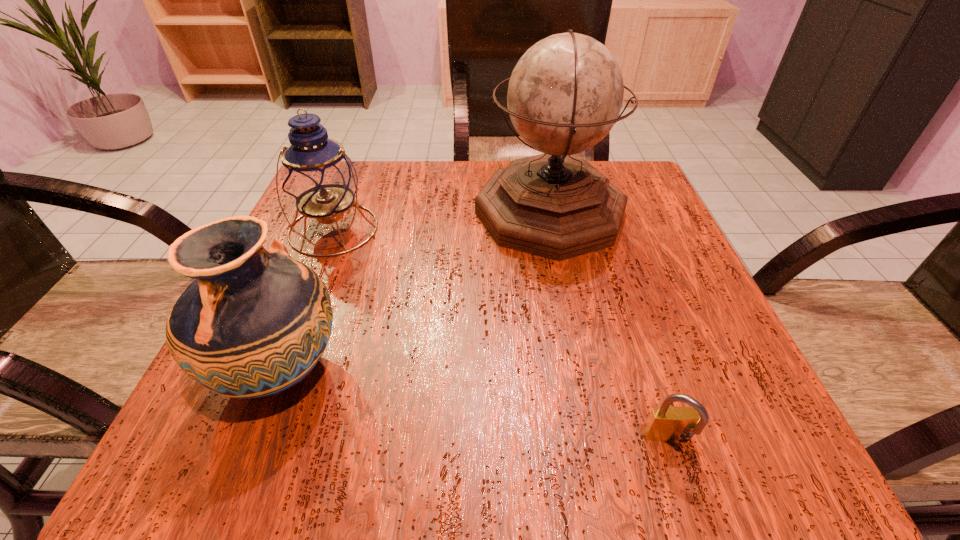
Identify the location of object situated at the near right corner. This screenshot has height=540, width=960. (667, 424).

In the image, there is a desktop. Where is `vacant space at the far edge`? The image size is (960, 540). vacant space at the far edge is located at coordinates tap(407, 163).

This screenshot has height=540, width=960. Identify the location of vacant region at the near edge of the desktop. point(494,438).

Where is `vacant space at the left edge of the desktop`? Image resolution: width=960 pixels, height=540 pixels. vacant space at the left edge of the desktop is located at coordinates (328, 356).

This screenshot has height=540, width=960. Find the location of `free region at the right edge`. free region at the right edge is located at coordinates coord(646,384).

You are a GUI agent. You are given a task and a screenshot of the screen. Output one action in this format:
    pyautogui.click(x=<x>, y=<y>)
    Task: Click on the vacant region at the far left corner of the desktop
    
    Given the screenshot: What is the action you would take?
    pyautogui.click(x=384, y=179)

Identify the location of free space at the far right corner. The width and height of the screenshot is (960, 540). (640, 178).

I want to click on vacant point located between the globe and the lantern, so click(x=442, y=221).

You are a GUI agent. You are given a task and a screenshot of the screen. Output one action in this format:
    pyautogui.click(x=<x>, y=<y>)
    Task: Click on the free point between the padlock and the pottery
    
    Given the screenshot: What is the action you would take?
    pyautogui.click(x=475, y=407)

The height and width of the screenshot is (540, 960). I want to click on free space between the pottery and the tallest object, so click(415, 292).